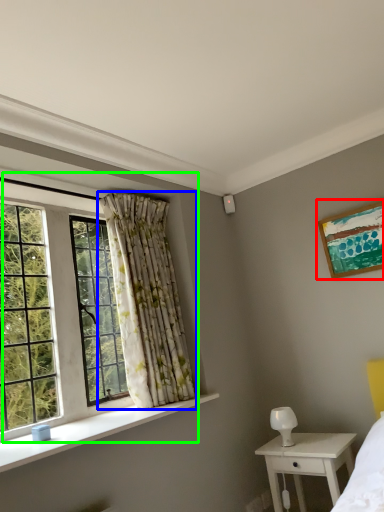
Question: Which object is the closest to the picture frame (highlighted by a red box)? Choose among these: curtain (highlighted by a blue box) or window (highlighted by a green box).

Choices:
 (A) curtain
 (B) window

Answer: (A)